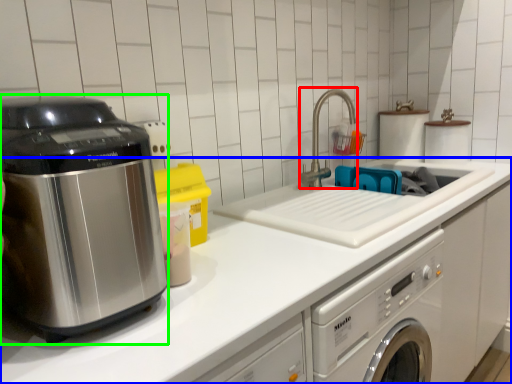
Question: Based on their relative distances, which object is farther from faucet (highlighted by a red box)? Choose from countertop (highlighted by a blue box) and home appliance (highlighted by a green box).

Choices:
 (A) countertop
 (B) home appliance

Answer: (B)